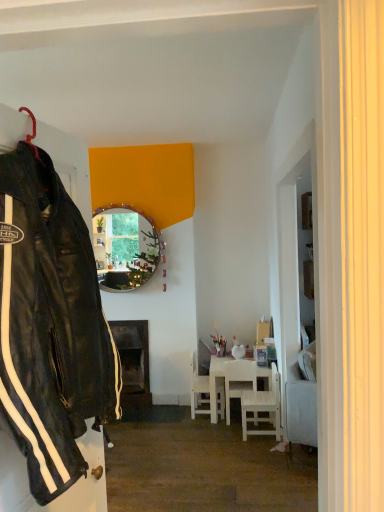
Question: Can you confirm if dark wood fireplace at center is wider than white wooden chair at center, the second chair in the front-to-back sequence?

Choices:
 (A) yes
 (B) no

Answer: (A)

Question: Does dark wood fireplace at center touch white wooden chair at center, arranged as the 2th chair when viewed from the back?

Choices:
 (A) no
 (B) yes

Answer: (A)

Question: Does dark wood fireplace at center appear on the left side of white wooden chair at center, the second chair in the front-to-back sequence?

Choices:
 (A) yes
 (B) no

Answer: (A)

Question: Is dark wood fireplace at center smaller than white wooden chair at center, arranged as the 2th chair when viewed from the back?

Choices:
 (A) yes
 (B) no

Answer: (B)

Question: Considering the relative sizes of dark wood fireplace at center and white wooden chair at center, the second chair in the front-to-back sequence, in the image provided, is dark wood fireplace at center shorter than white wooden chair at center, the second chair in the front-to-back sequence,?

Choices:
 (A) yes
 (B) no

Answer: (B)

Question: From a real-world perspective, is dark wood fireplace at center located higher than white wooden chair at center, arranged as the 2th chair when viewed from the back?

Choices:
 (A) no
 (B) yes

Answer: (B)

Question: From a real-world perspective, is white glossy table at center physically below dark wood fireplace at center?

Choices:
 (A) yes
 (B) no

Answer: (A)

Question: Is white glossy table at center looking in the opposite direction of dark wood fireplace at center?

Choices:
 (A) no
 (B) yes

Answer: (A)

Question: Is white glossy table at center in contact with dark wood fireplace at center?

Choices:
 (A) no
 (B) yes

Answer: (A)

Question: Can you confirm if white glossy table at center is thinner than dark wood fireplace at center?

Choices:
 (A) yes
 (B) no

Answer: (B)

Question: Does white glossy table at center lie in front of dark wood fireplace at center?

Choices:
 (A) no
 (B) yes

Answer: (B)

Question: Is the position of white glossy table at center more distant than that of dark wood fireplace at center?

Choices:
 (A) yes
 (B) no

Answer: (B)

Question: Can you confirm if white wooden chair at lower right, positioned as the third chair in back-to-front order, is taller than white matte chair at center, placed as the 3th chair when sorted from front to back?

Choices:
 (A) no
 (B) yes

Answer: (A)